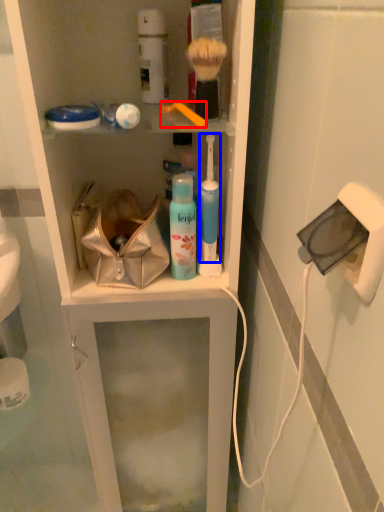
Question: Which object appears closest to the camera in this image, brush (highlighted by a red box) or toiletry (highlighted by a blue box)?

Choices:
 (A) brush
 (B) toiletry

Answer: (A)